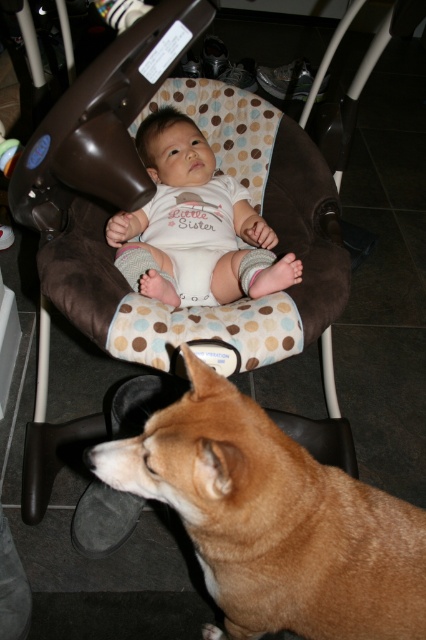
Looking at this image, you are a photographer setting up for a family photo. The baby is in the brown and beige patterned baby bouncer, and there is a brown fur dog at lower center. To ensure the dog stays in frame, where should you position the camera relative to the baby?

The brown fur dog at lower center is located at point (273, 520), so position the camera so it captures the area around those coordinates to keep the dog in frame with the baby.

What is the location of the point with coordinates (149, 196) in the image?

The point with coordinates (149, 196) is located on the brown fabric baby carriage at upper center.